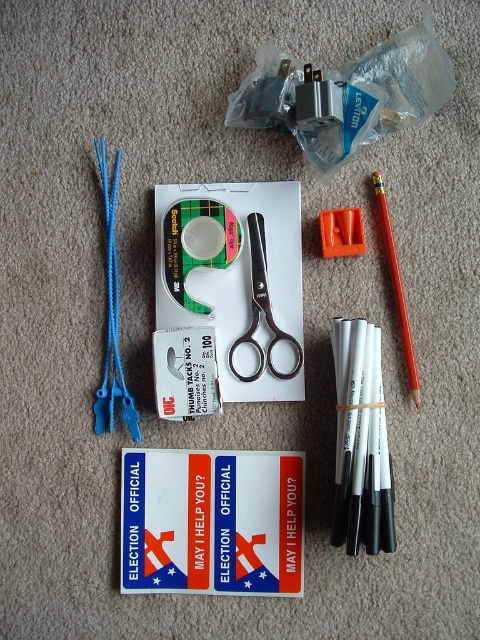
Question: Based on their relative distances, which object is farther from the green matte tape at center?

Choices:
 (A) silver metallic scissors at center
 (B) orange plastic pencil at right
 (C) blue plastic ties at left
 (D) white matte pencil at right

Answer: (D)

Question: Does white matte pencil at right have a lesser width compared to orange plastic pencil at right?

Choices:
 (A) yes
 (B) no

Answer: (B)

Question: Observing the image, what is the correct spatial positioning of white matte pencil at right in reference to orange plastic pencil at right?

Choices:
 (A) left
 (B) right

Answer: (A)

Question: Is white matte pencil at right thinner than green matte tape at center?

Choices:
 (A) yes
 (B) no

Answer: (A)

Question: Estimate the real-world distances between objects in this image. Which object is farther from the blue plastic ties at left?

Choices:
 (A) white matte pencil at right
 (B) orange plastic pencil at right
 (C) silver metallic scissors at center
 (D) green matte tape at center

Answer: (B)

Question: Based on their relative distances, which object is nearer to the white matte pencil at right?

Choices:
 (A) orange plastic pencil at right
 (B) blue plastic ties at left

Answer: (A)